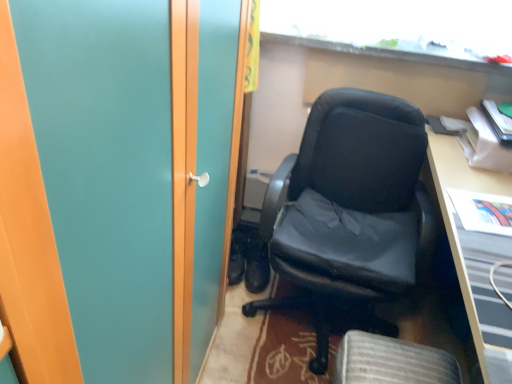
The height and width of the screenshot is (384, 512). I want to click on free space above black leather swivel chair at lower center (from a real-world perspective), so click(390, 363).